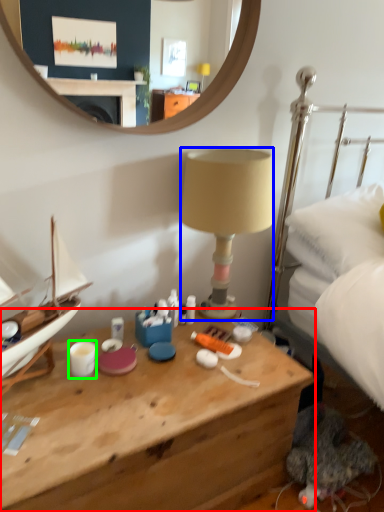
Question: Which object is the closest to the desk (highlighted by a red box)? Choose among these: lamp (highlighted by a blue box) or coffee cup (highlighted by a green box).

Choices:
 (A) lamp
 (B) coffee cup

Answer: (B)